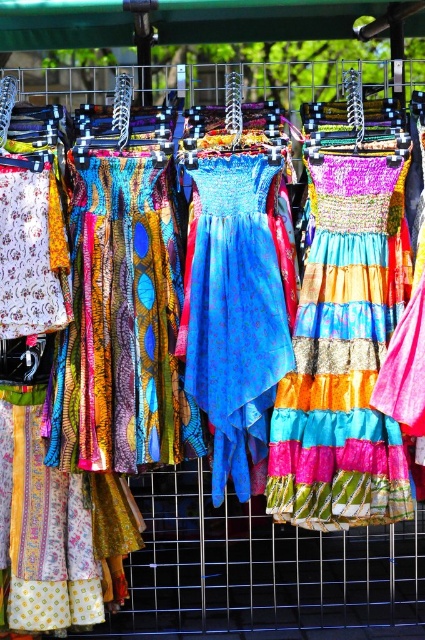
You are a customer at a clothing store and see the shiny multicolored skirt at center and the shiny blue fabric dress at center hanging on the rack. Which one is hanging lower on the rack?

The shiny multicolored skirt at center is positioned under the shiny blue fabric dress at center, so it is hanging lower on the rack.

You are a customer at an outdoor clothing rack. You see the shiny multicolored skirt at center and the shiny blue fabric dress at center. Which one is positioned to the right of the other?

The shiny multicolored skirt at center is positioned to the right of the shiny blue fabric dress at center.